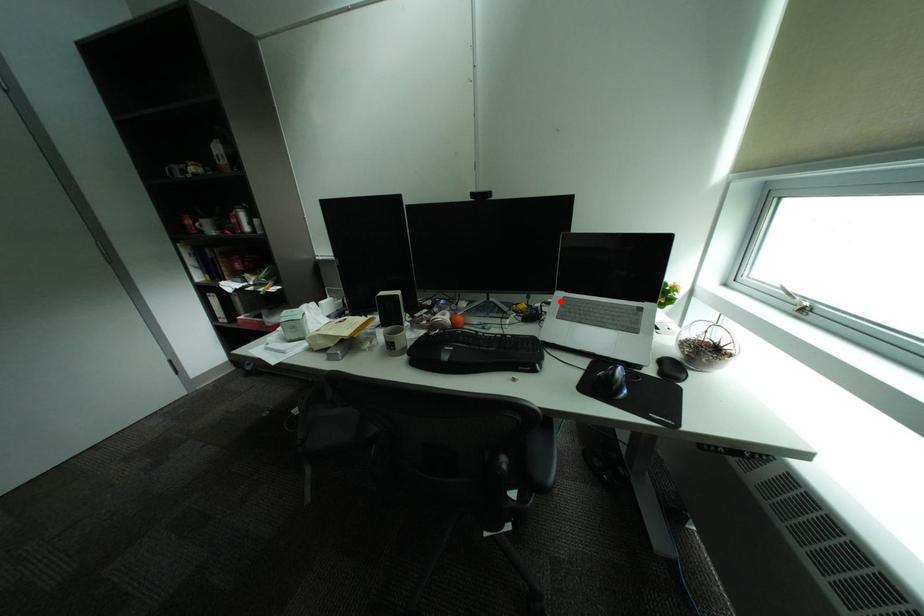
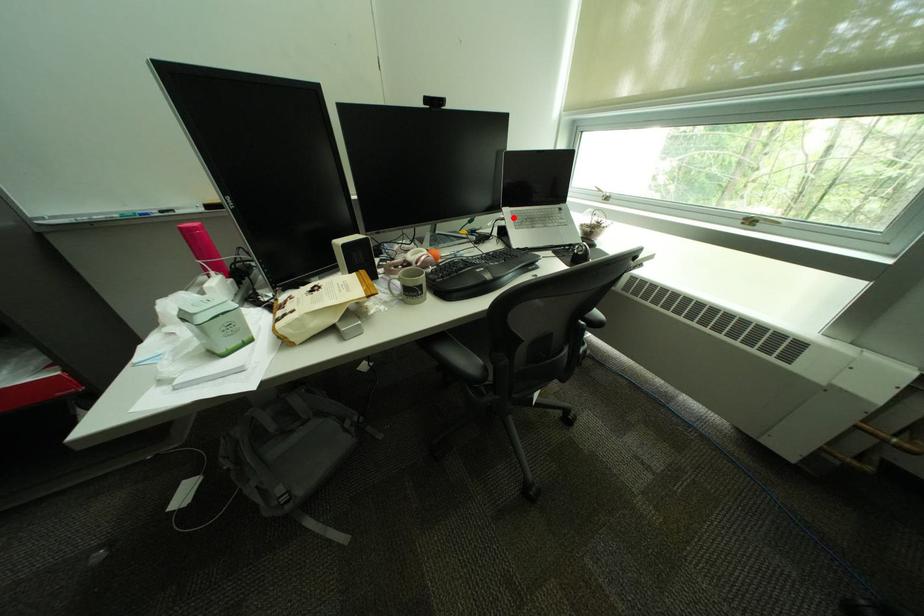
I am providing you with two images of the same scene from different viewpoints. A red point is marked on the first image and another point is marked on the second image. Does the point marked in image1 correspond to the same location as the one in image2?

Yes